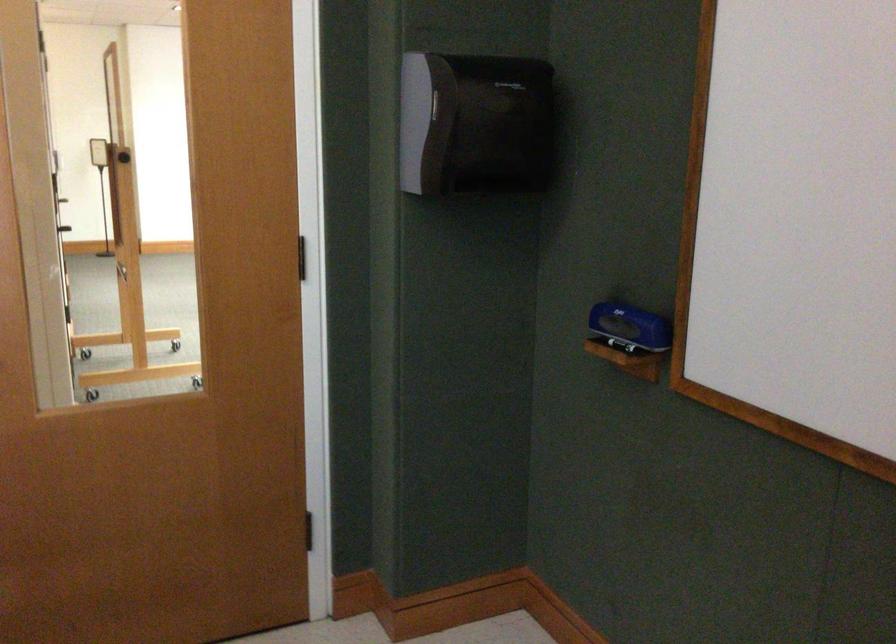
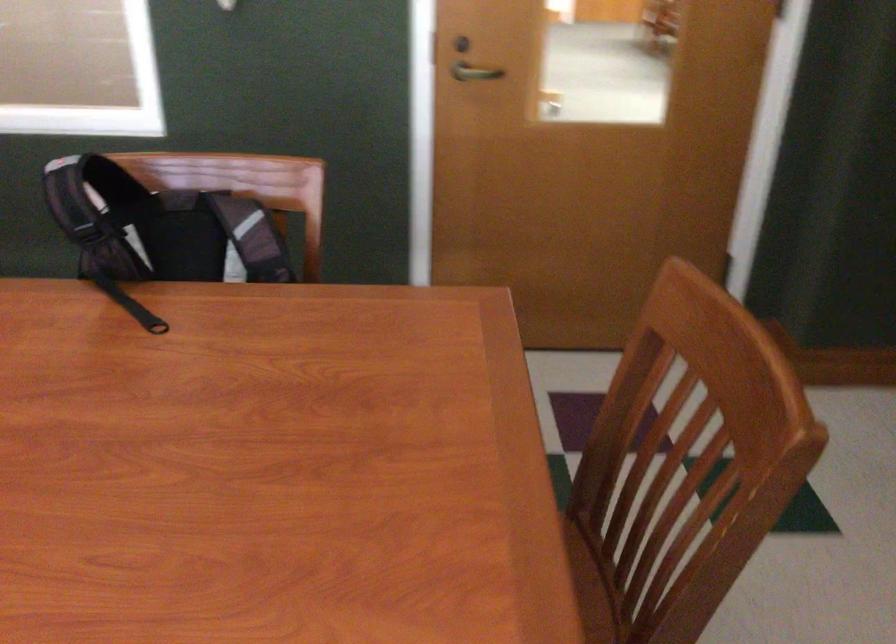
Based on the continuous images, in which direction is the camera rotating?

The camera rotated toward left-down.